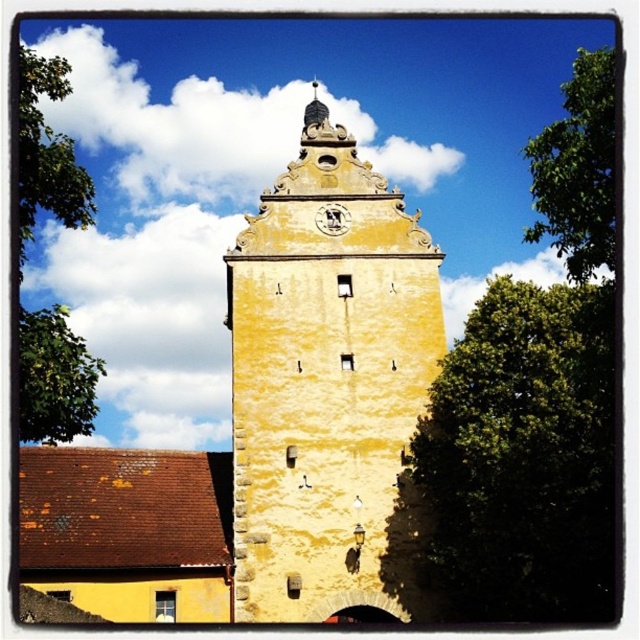
Question: Which object is the farthest from the green leafy tree at right?

Choices:
 (A) green leafy tree at upper right
 (B) gold textured clock at upper center
 (C) green leafy tree at upper left
 (D) yellow stone tower at center

Answer: (C)

Question: Can you confirm if green leafy tree at upper right is thinner than green leafy tree at upper left?

Choices:
 (A) no
 (B) yes

Answer: (B)

Question: Is green leafy tree at upper left further to the viewer compared to gold textured clock at upper center?

Choices:
 (A) no
 (B) yes

Answer: (A)

Question: Is green leafy tree at upper left bigger than green leafy tree at left?

Choices:
 (A) no
 (B) yes

Answer: (B)

Question: Which object appears farthest from the camera in this image?

Choices:
 (A) green leafy tree at left
 (B) green leafy tree at upper right
 (C) yellow stone tower at center
 (D) gold textured clock at upper center

Answer: (D)

Question: Among these objects, which one is farthest from the camera?

Choices:
 (A) gold textured clock at upper center
 (B) green leafy tree at left
 (C) green leafy tree at upper left
 (D) green leafy tree at right

Answer: (A)